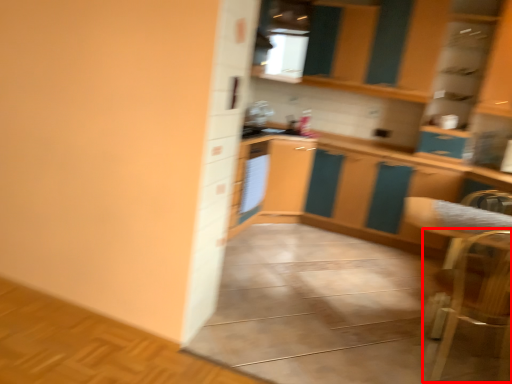
Question: From the image's perspective, where is armchair (annotated by the red box) located relative to appliance?

Choices:
 (A) below
 (B) above

Answer: (A)